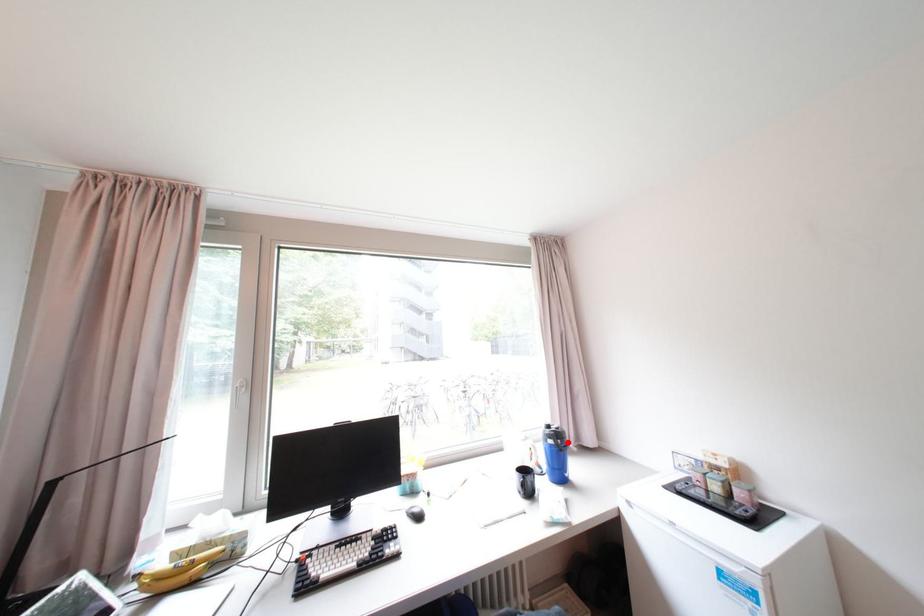
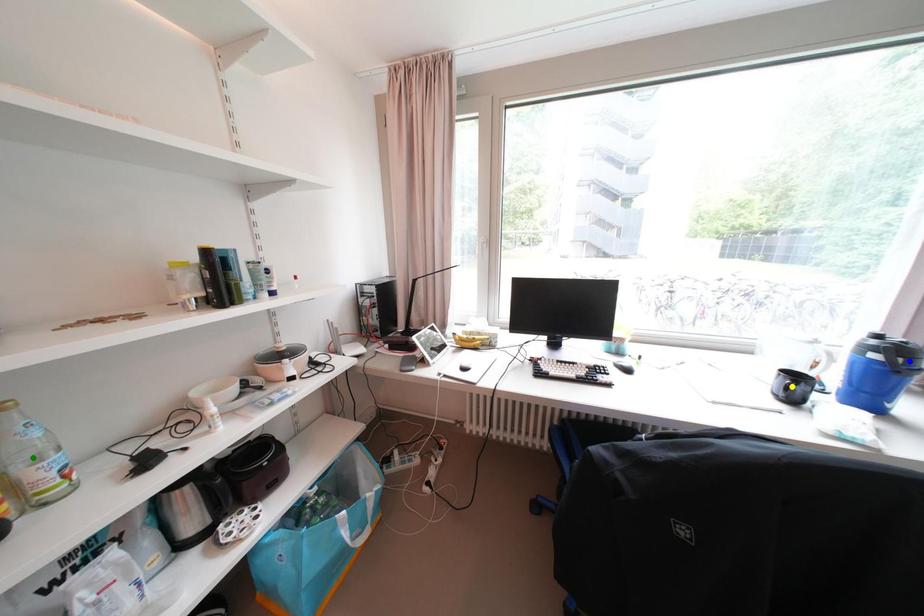
Question: I am providing you with two images of the same scene from different viewpoints. A red point is marked on the first image. You are given multiple points on the second image. Which spot in image 2 lines up with the point in image 1?

Choices:
 (A) blue point
 (B) green point
 (C) yellow point

Answer: (A)